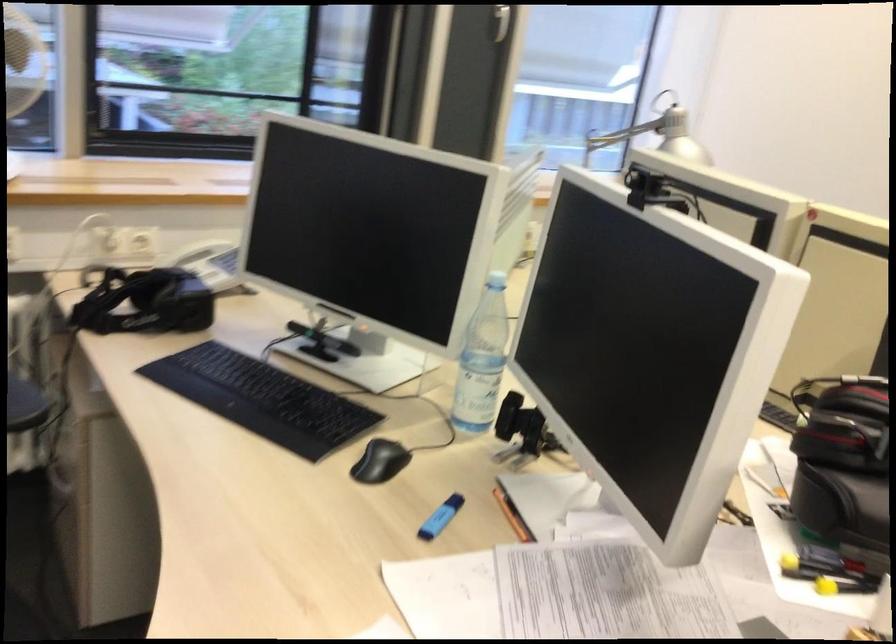
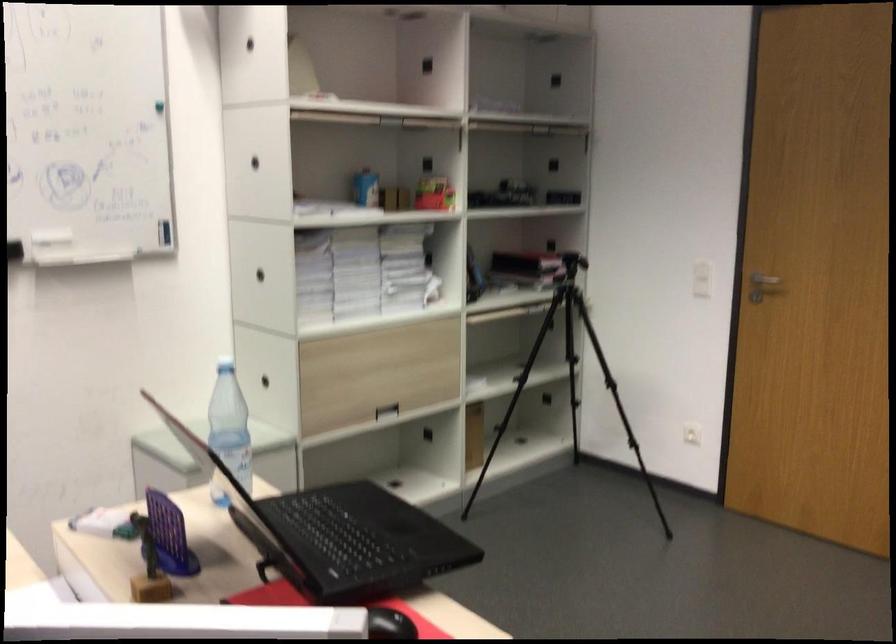
Based on the photo, the first image is from the beginning of the video and the second image is from the end. How did the camera likely rotate when shooting the video?

The camera rotated toward right-down.